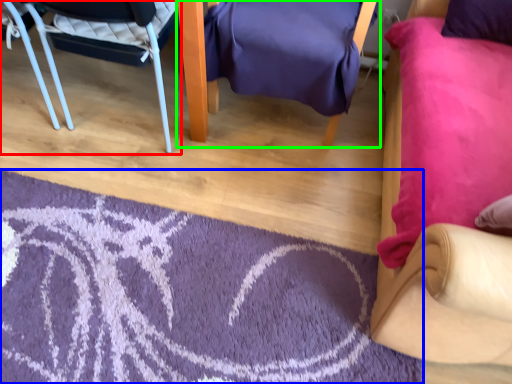
Question: Which is nearer to the chair (highlighted by a red box)? mat (highlighted by a blue box) or chair (highlighted by a green box).

Choices:
 (A) mat
 (B) chair

Answer: (B)